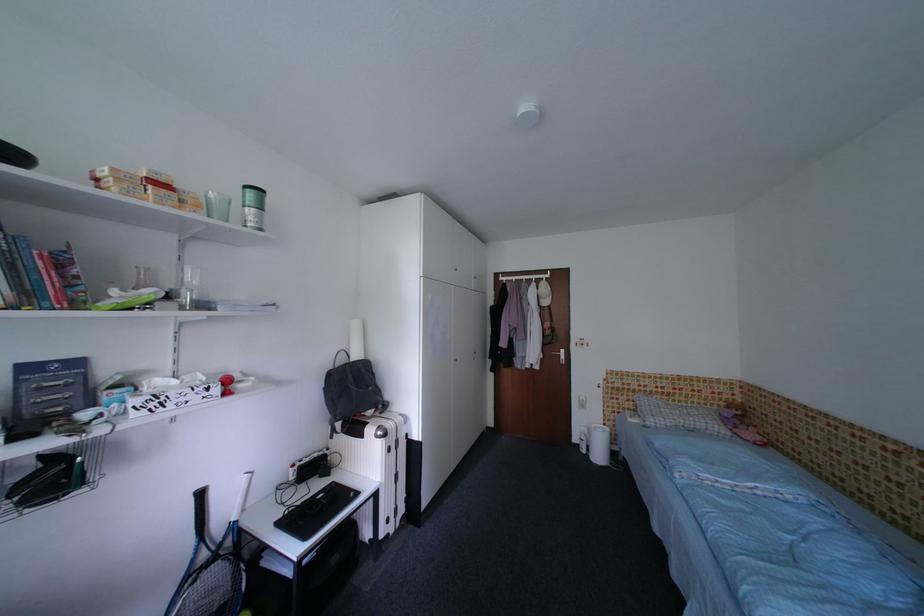
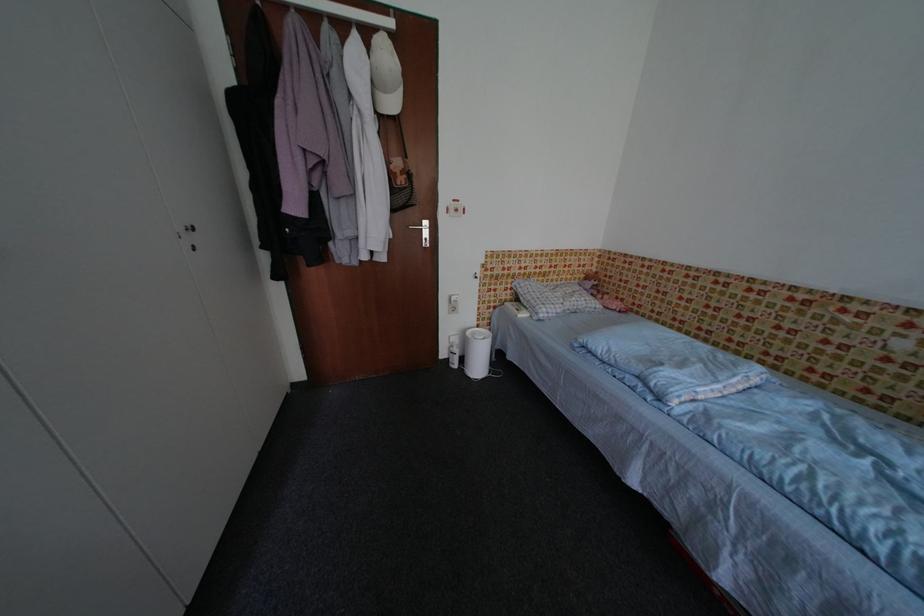
Locate, in the second image, the point that corresponds to [707,406] in the first image.

(574, 282)